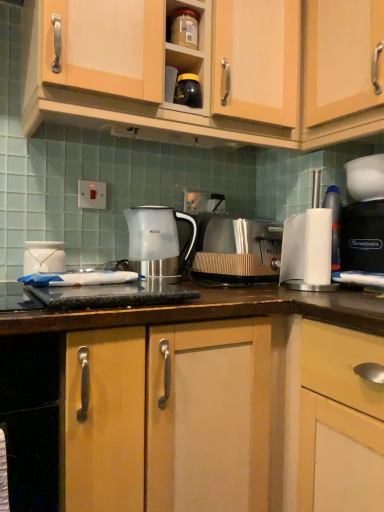
Question: From a real-world perspective, is metallic silver toaster at center over black plastic coffee machine at right?

Choices:
 (A) no
 (B) yes

Answer: (A)

Question: From the image's perspective, would you say metallic silver toaster at center is positioned over black plastic coffee machine at right?

Choices:
 (A) yes
 (B) no

Answer: (B)

Question: From a real-world perspective, is metallic silver toaster at center under black plastic coffee machine at right?

Choices:
 (A) no
 (B) yes

Answer: (B)

Question: Is metallic silver toaster at center placed right next to black plastic coffee machine at right?

Choices:
 (A) yes
 (B) no

Answer: (B)

Question: Is black plastic coffee machine at right at the back of metallic silver toaster at center?

Choices:
 (A) yes
 (B) no

Answer: (B)

Question: Is metallic silver toaster at center positioned in front of black plastic coffee machine at right?

Choices:
 (A) yes
 (B) no

Answer: (A)

Question: Does white glossy jar at left, which is the first appliance in bottom-to-top order, lie in front of black glossy jar at upper center, which is the second appliance in bottom-to-top order?

Choices:
 (A) yes
 (B) no

Answer: (A)

Question: Can you confirm if white glossy jar at left, the 2th appliance positioned from the top, is thinner than black glossy jar at upper center, which is the second appliance in bottom-to-top order?

Choices:
 (A) yes
 (B) no

Answer: (B)

Question: From a real-world perspective, is white glossy jar at left, which is the first appliance in bottom-to-top order, positioned over black glossy jar at upper center, placed as the first appliance when sorted from right to left, based on gravity?

Choices:
 (A) no
 (B) yes

Answer: (A)

Question: Is white glossy jar at left, which is the first appliance in bottom-to-top order, positioned beyond the bounds of black glossy jar at upper center, the first appliance in the top-to-bottom sequence?

Choices:
 (A) no
 (B) yes

Answer: (B)

Question: Does white glossy jar at left, the second appliance when ordered from right to left, have a smaller size compared to black glossy jar at upper center, the first appliance in the top-to-bottom sequence?

Choices:
 (A) yes
 (B) no

Answer: (B)

Question: Can you confirm if white glossy jar at left, the 1th appliance positioned from the left, is shorter than black glossy jar at upper center, the first appliance in the top-to-bottom sequence?

Choices:
 (A) no
 (B) yes

Answer: (A)

Question: Is white glossy jar at left, the second appliance when ordered from right to left, positioned before translucent plastic kettle at center?

Choices:
 (A) yes
 (B) no

Answer: (A)